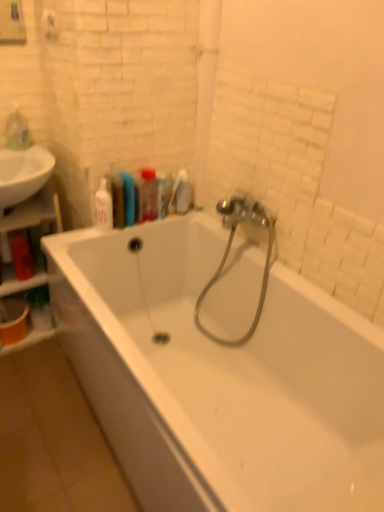
Question: Should I look upward or downward to see translucent plastic bottle at upper center, marked as the 2th toiletry in a right-to-left arrangement?

Choices:
 (A) up
 (B) down

Answer: (A)

Question: Is wooden shelf at left at the left side of translucent plastic bottle at upper center, marked as the third toiletry in a left-to-right arrangement?

Choices:
 (A) yes
 (B) no

Answer: (A)

Question: From the image's perspective, is wooden shelf at left below translucent plastic bottle at upper center, marked as the third toiletry in a left-to-right arrangement?

Choices:
 (A) no
 (B) yes

Answer: (B)

Question: From the image's perspective, is wooden shelf at left located above translucent plastic bottle at upper center, marked as the 2th toiletry in a right-to-left arrangement?

Choices:
 (A) no
 (B) yes

Answer: (A)

Question: Is translucent plastic bottle at upper center, marked as the third toiletry in a left-to-right arrangement, a part of wooden shelf at left?

Choices:
 (A) no
 (B) yes

Answer: (A)

Question: From a real-world perspective, is wooden shelf at left beneath translucent plastic bottle at upper center, marked as the 2th toiletry in a right-to-left arrangement?

Choices:
 (A) no
 (B) yes

Answer: (B)

Question: Is wooden shelf at left not close to translucent plastic bottle at upper center, marked as the 2th toiletry in a right-to-left arrangement?

Choices:
 (A) no
 (B) yes

Answer: (A)

Question: Is translucent plastic bottle at upper center, marked as the 2th toiletry in a right-to-left arrangement, at the right side of metallic silver garden hose at center?

Choices:
 (A) no
 (B) yes

Answer: (A)

Question: Is translucent plastic bottle at upper center, marked as the third toiletry in a left-to-right arrangement, shorter than metallic silver garden hose at center?

Choices:
 (A) yes
 (B) no

Answer: (A)

Question: Does translucent plastic bottle at upper center, marked as the third toiletry in a left-to-right arrangement, lie in front of metallic silver garden hose at center?

Choices:
 (A) yes
 (B) no

Answer: (B)

Question: Would you say metallic silver garden hose at center is part of translucent plastic bottle at upper center, marked as the 2th toiletry in a right-to-left arrangement,'s contents?

Choices:
 (A) no
 (B) yes

Answer: (A)

Question: Can you confirm if translucent plastic bottle at upper center, marked as the 2th toiletry in a right-to-left arrangement, is thinner than metallic silver garden hose at center?

Choices:
 (A) no
 (B) yes

Answer: (B)

Question: Can you confirm if translucent plastic bottle at upper center, marked as the third toiletry in a left-to-right arrangement, is taller than metallic silver garden hose at center?

Choices:
 (A) yes
 (B) no

Answer: (B)

Question: Does white glossy soap dispenser at upper left, the 2th toiletry from the left, have a greater height compared to translucent plastic bottle at upper center, marked as the third toiletry in a left-to-right arrangement?

Choices:
 (A) no
 (B) yes

Answer: (B)